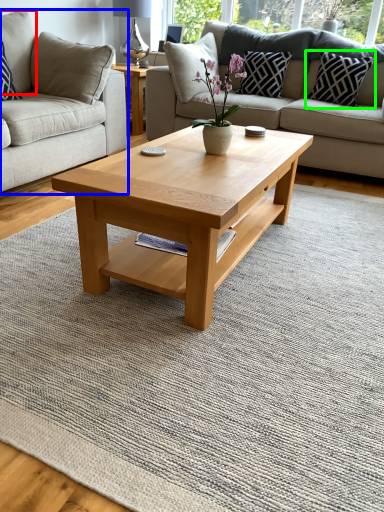
Question: Considering the real-world distances, which object is farthest from pillow (highlighted by a red box)? studio couch (highlighted by a blue box) or pillow (highlighted by a green box)?

Choices:
 (A) studio couch
 (B) pillow

Answer: (B)